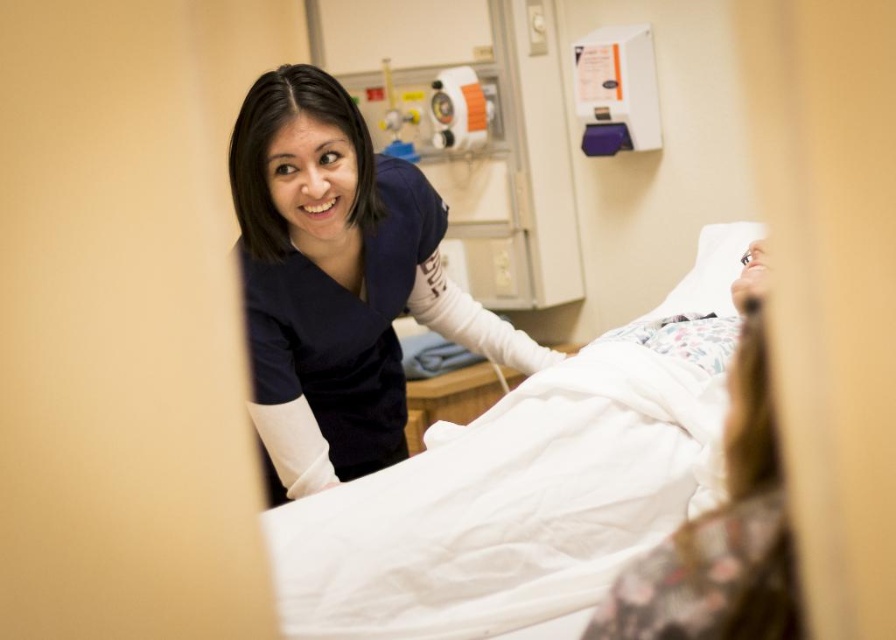
Can you confirm if white smooth bed at center is bigger than white fabric at right?

Yes, white smooth bed at center is bigger than white fabric at right.

Is point (696, 328) behind point (666, 577)?

Yes.

Image resolution: width=896 pixels, height=640 pixels. I want to click on white smooth bed at center, so click(x=527, y=484).

From the picture: Can you confirm if white smooth bed at center is thinner than navy blue scrubs at upper center?

No, white smooth bed at center is not thinner than navy blue scrubs at upper center.

Does white smooth bed at center have a smaller size compared to navy blue scrubs at upper center?

No, white smooth bed at center is not smaller than navy blue scrubs at upper center.

Find the location of a particular element. white smooth bed at center is located at coordinates (527, 484).

Does navy blue scrubs at upper center appear over white fabric at right?

Indeed, navy blue scrubs at upper center is positioned over white fabric at right.

Is navy blue scrubs at upper center positioned before white fabric at right?

No, navy blue scrubs at upper center is behind white fabric at right.

Image resolution: width=896 pixels, height=640 pixels. Identify the location of navy blue scrubs at upper center. (338, 282).